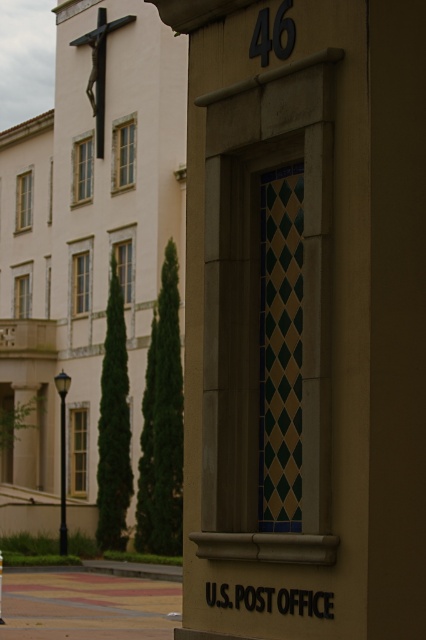
Which is above, paved brick sidewalk at lower left or black metal crucifix at upper left?

black metal crucifix at upper left

Which is in front, point (68, 577) or point (109, 26)?

Point (68, 577) is more forward.

Identify the location of paved brick sidewalk at lower left. (86, 605).

Can you confirm if paved brick sidewalk at lower left is positioned to the right of smooth black pole at left?

Yes, paved brick sidewalk at lower left is to the right of smooth black pole at left.

Does paved brick sidewalk at lower left have a lesser height compared to smooth black pole at left?

Indeed, paved brick sidewalk at lower left has a lesser height compared to smooth black pole at left.

Does point (86, 579) lie in front of point (60, 520)?

That is True.

Where is `paved brick sidewalk at lower left`? This screenshot has height=640, width=426. paved brick sidewalk at lower left is located at coordinates (86, 605).

Based on the photo, can you confirm if black metal crucifix at upper left is positioned below smooth black pole at left?

Actually, black metal crucifix at upper left is above smooth black pole at left.

Is black metal crucifix at upper left bigger than smooth black pole at left?

Actually, black metal crucifix at upper left might be smaller than smooth black pole at left.

Between point (103, 109) and point (60, 545), which one is positioned in front?

Point (60, 545)

At what (x,y) coordinates should I click in order to perform the action: click on black metal crucifix at upper left. Please return your answer as a coordinate pair (x, y). The height and width of the screenshot is (640, 426). Looking at the image, I should click on (98, 68).